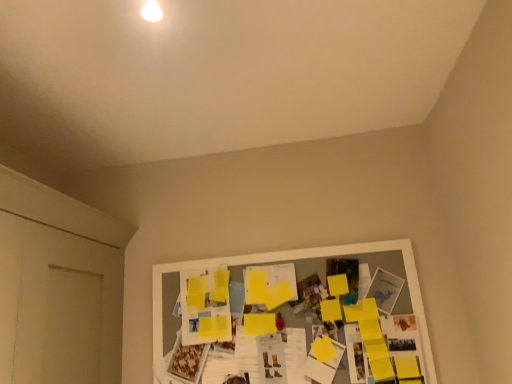
Question: From the image's perspective, relative to white matte door at left, is yellow paper at center above or below?

Choices:
 (A) below
 (B) above

Answer: (A)

Question: In the image, is yellow paper at center on the left side or the right side of white matte door at left?

Choices:
 (A) left
 (B) right

Answer: (B)

Question: In terms of height, does yellow paper at center look taller or shorter compared to white matte door at left?

Choices:
 (A) tall
 (B) short

Answer: (B)

Question: Considering the positions of white matte door at left and yellow paper at center in the image, is white matte door at left wider or thinner than yellow paper at center?

Choices:
 (A) thin
 (B) wide

Answer: (B)

Question: Is white matte door at left bigger or smaller than yellow paper at center?

Choices:
 (A) small
 (B) big

Answer: (B)

Question: Choose the correct answer: Is white matte door at left inside yellow paper at center or outside it?

Choices:
 (A) inside
 (B) outside

Answer: (B)

Question: Is point (31, 324) closer or farther from the camera than point (411, 251)?

Choices:
 (A) farther
 (B) closer

Answer: (B)